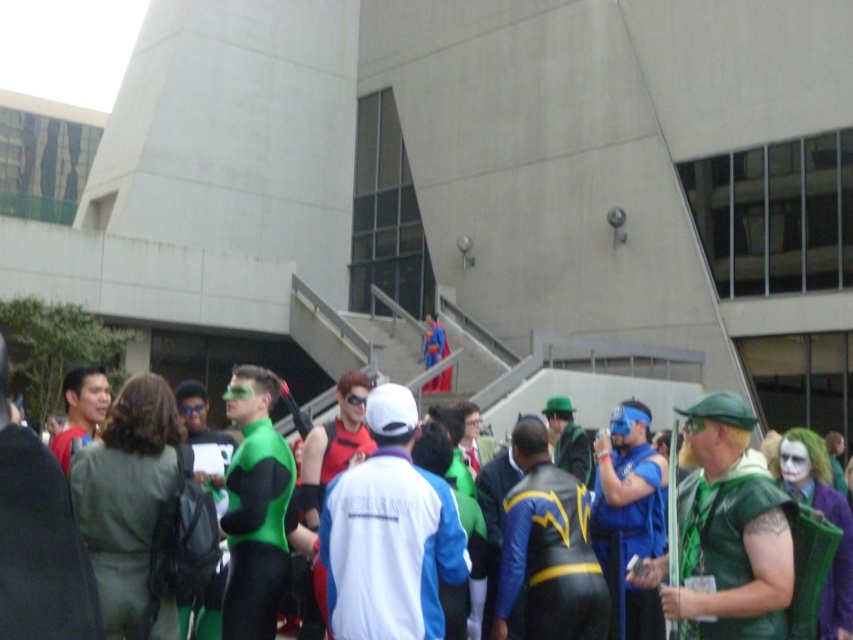
Question: Is the position of green spandex suit at center more distant than that of shiny blue costume at center?

Choices:
 (A) yes
 (B) no

Answer: (B)

Question: Does leather-like blue and yellow suit at center appear on the right side of shiny blue costume at center?

Choices:
 (A) yes
 (B) no

Answer: (A)

Question: Which point is closer to the camera?

Choices:
 (A) leather-like blue and yellow suit at center
 (B) shiny blue costume at center

Answer: (A)

Question: Based on their relative distances, which object is nearer to the leather-like blue and yellow suit at center?

Choices:
 (A) shiny blue costume at center
 (B) green spandex suit at center

Answer: (B)

Question: Considering the relative positions of leather-like blue and yellow suit at center and shiny blue costume at center in the image provided, where is leather-like blue and yellow suit at center located with respect to shiny blue costume at center?

Choices:
 (A) right
 (B) left

Answer: (A)

Question: Which point is closer to the camera taking this photo?

Choices:
 (A) (57, 557)
 (B) (437, 332)
 (C) (576, 600)

Answer: (A)